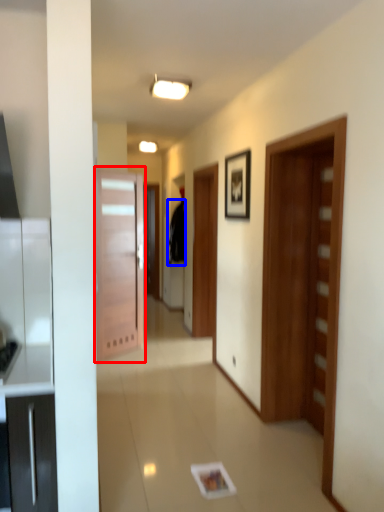
Question: Among these objects, which one is farthest to the camera, door (highlighted by a red box) or robe (highlighted by a blue box)?

Choices:
 (A) door
 (B) robe

Answer: (B)